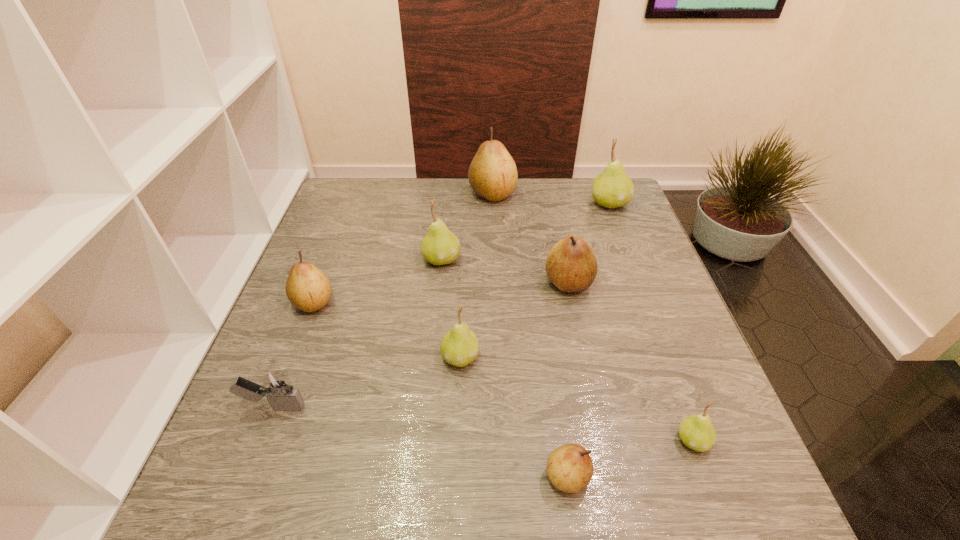
Where is `the farthest brown pear`? The width and height of the screenshot is (960, 540). the farthest brown pear is located at coordinates (492, 175).

The width and height of the screenshot is (960, 540). In order to click on the biggest green pear in this screenshot , I will do `click(613, 188)`.

Where is `the second farthest green pear`? The image size is (960, 540). the second farthest green pear is located at coordinates (440, 246).

This screenshot has height=540, width=960. I want to click on the third smallest brown pear, so click(571, 265).

Find the location of `the leftmost brown pear`. the leftmost brown pear is located at coordinates (308, 288).

Locate an element on the screen. the leftmost pear is located at coordinates (308, 288).

In order to click on the second smallest green pear in this screenshot , I will do `click(459, 347)`.

The width and height of the screenshot is (960, 540). I want to click on the sixth farthest pear, so click(x=459, y=347).

You are a GUI agent. You are given a task and a screenshot of the screen. Output one action in this format:
    pyautogui.click(x=<x>, y=<y>)
    Task: Click on the third nearest object
    
    Given the screenshot: What is the action you would take?
    pyautogui.click(x=276, y=386)

Where is `gray igniter`? This screenshot has height=540, width=960. gray igniter is located at coordinates (276, 386).